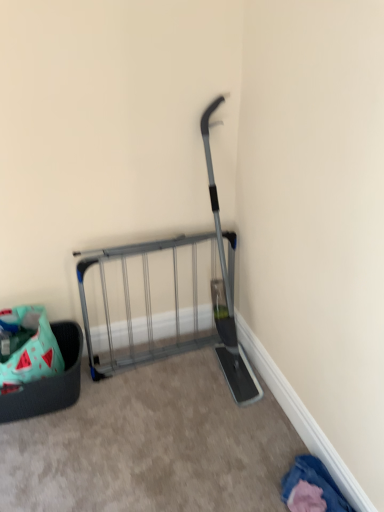
Question: Can you confirm if denim fabric pants at lower right is shorter than silver metallic gate at center?

Choices:
 (A) no
 (B) yes

Answer: (B)

Question: Can you confirm if denim fabric pants at lower right is bigger than silver metallic gate at center?

Choices:
 (A) yes
 (B) no

Answer: (B)

Question: Is silver metallic gate at center a part of denim fabric pants at lower right?

Choices:
 (A) no
 (B) yes

Answer: (A)

Question: Is denim fabric pants at lower right positioned in front of silver metallic gate at center?

Choices:
 (A) yes
 (B) no

Answer: (A)

Question: Does denim fabric pants at lower right appear on the right side of silver metallic gate at center?

Choices:
 (A) no
 (B) yes

Answer: (B)

Question: Looking at their shapes, would you say mint fabric basket at lower left is wider or thinner than silver metallic gate at center?

Choices:
 (A) wide
 (B) thin

Answer: (A)

Question: Considering the positions of mint fabric basket at lower left and silver metallic gate at center in the image, is mint fabric basket at lower left taller or shorter than silver metallic gate at center?

Choices:
 (A) short
 (B) tall

Answer: (A)

Question: Considering the positions of point (18, 413) and point (107, 373), is point (18, 413) closer or farther from the camera than point (107, 373)?

Choices:
 (A) farther
 (B) closer

Answer: (B)

Question: Do you think mint fabric basket at lower left is within silver metallic gate at center, or outside of it?

Choices:
 (A) inside
 (B) outside

Answer: (B)

Question: Visually, is silver metallic gate at center positioned to the left or to the right of mint fabric basket at lower left?

Choices:
 (A) left
 (B) right

Answer: (B)

Question: From the image's perspective, is silver metallic gate at center above or below mint fabric basket at lower left?

Choices:
 (A) below
 (B) above

Answer: (B)

Question: Considering the positions of silver metallic gate at center and mint fabric basket at lower left in the image, is silver metallic gate at center taller or shorter than mint fabric basket at lower left?

Choices:
 (A) tall
 (B) short

Answer: (A)

Question: Which is correct: silver metallic gate at center is inside mint fabric basket at lower left, or outside of it?

Choices:
 (A) outside
 (B) inside

Answer: (A)

Question: Is silver metallic gate at center wider or thinner than denim fabric pants at lower right?

Choices:
 (A) thin
 (B) wide

Answer: (A)

Question: Is point (109, 365) positioned closer to the camera than point (304, 501)?

Choices:
 (A) farther
 (B) closer

Answer: (A)